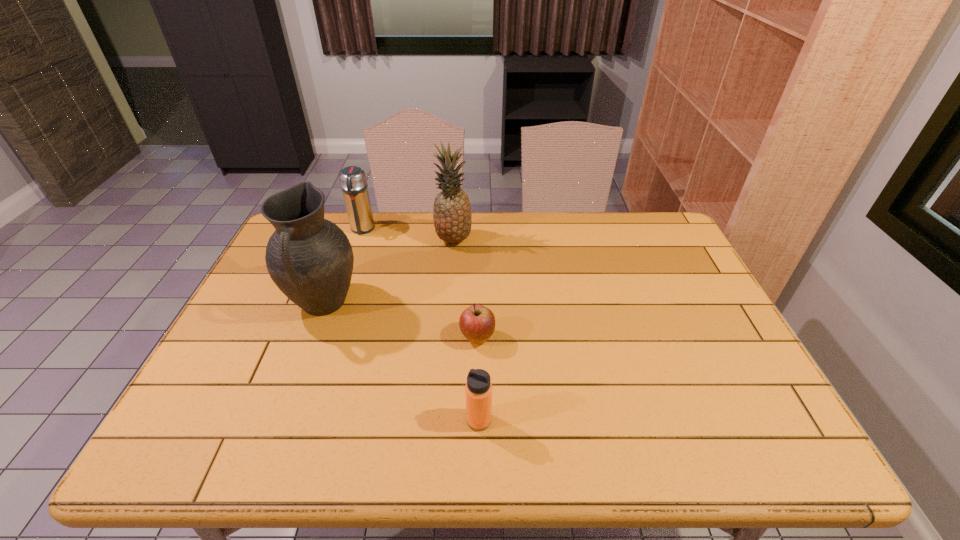
This screenshot has width=960, height=540. I want to click on pineapple, so click(452, 215).

Identify the location of pitcher. Image resolution: width=960 pixels, height=540 pixels. (310, 259).

Identify the location of the third tallest object. (353, 180).

This screenshot has width=960, height=540. Find the location of `the taller thermos bottle`. the taller thermos bottle is located at coordinates (353, 180).

Identify the location of the nearest object. The height and width of the screenshot is (540, 960). point(478,390).

At what (x,y) coordinates should I click in order to perform the action: click on the nearer thermos bottle. Please return your answer as a coordinate pair (x, y). Image resolution: width=960 pixels, height=540 pixels. Looking at the image, I should click on click(x=478, y=390).

This screenshot has width=960, height=540. I want to click on apple, so click(x=477, y=323).

Identify the location of vacant space located on the front of the pineapple. (445, 347).

This screenshot has width=960, height=540. Find the location of `blank area located on the side of the pitcher with the handle`. blank area located on the side of the pitcher with the handle is located at coordinates (289, 394).

This screenshot has width=960, height=540. What are the coordinates of `vacant space located 0.370m with a handle on the side of the taller thermos bottle` in the screenshot? It's located at (331, 318).